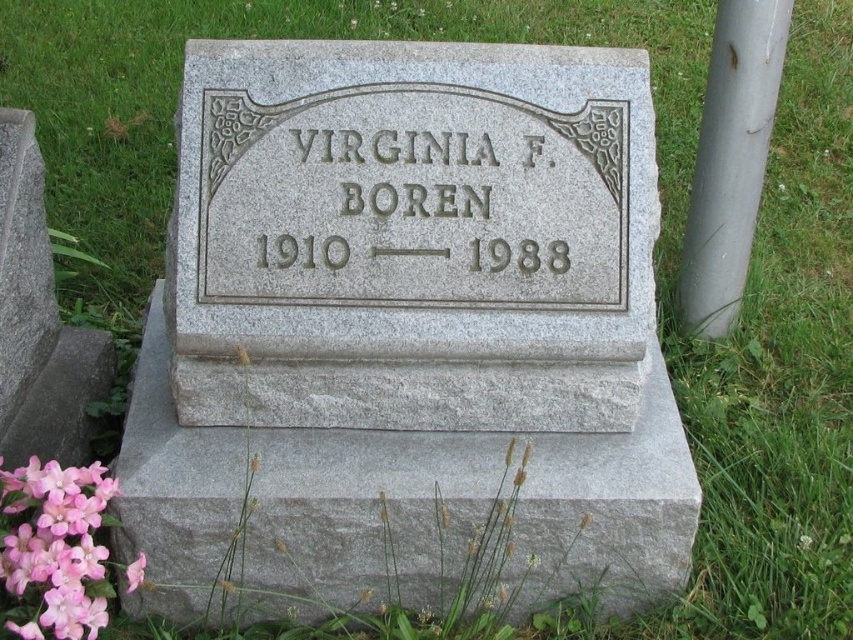
Consider the image. You are a visitor at the cemetery and want to place a pink matte flower at lower left near the gray granite inscription at center. Can you place the flower directly in front of the inscription so it doesn

The gray granite inscription at center is not as tall as the pink matte flower at lower left, so placing the flower directly in front of the inscription would block the view of the inscription because the flower is taller.

From the picture: You are standing in front of the gravestone and want to place a pink matte flower at lower left near the gray metallic pole at right. Based on their positions, which object is located to the east?

The gray metallic pole at right is located to the east of the pink matte flower at lower left because the gray metallic pole at right is to the right of the pink matte flower at lower left, and in the image, right corresponds to east.

From the picture: You are standing in front of the gravestone and notice both the gray granite inscription at center and the gray metallic pole at right. Which object is positioned to the right side?

The gray metallic pole at right is positioned to the right side.